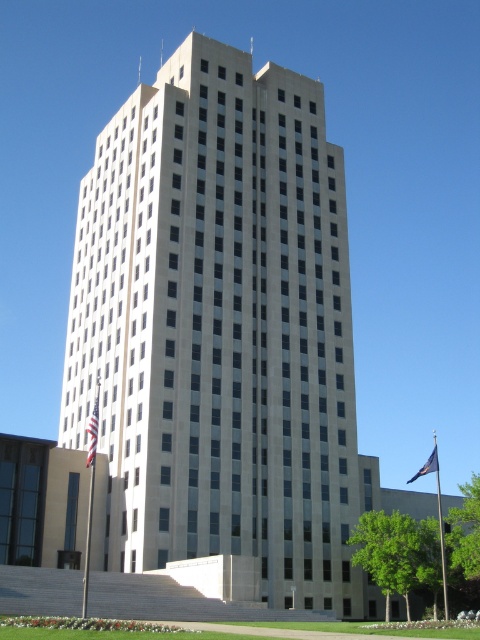
What do you see at coordinates (440, 522) in the screenshot? Image resolution: width=480 pixels, height=640 pixels. I see `metallic flag pole at lower right` at bounding box center [440, 522].

Consider the image. Who is more forward, (444, 589) or (434, 467)?

Point (444, 589) is more forward.

This screenshot has height=640, width=480. Identify the location of metallic flag pole at lower right. (440, 522).

Does beige concrete tower at center appear over american flag at left?

Yes, beige concrete tower at center is above american flag at left.

Which is more to the right, beige concrete tower at center or american flag at left?

beige concrete tower at center

Between point (352, 444) and point (90, 419), which one is positioned behind?

The point (90, 419) is behind.

I want to click on beige concrete tower at center, so click(x=220, y=328).

Who is more forward, (92,460) or (429,460)?

Point (92,460) is in front.

Can you confirm if american flag at left is taller than blue fabric flag at lower right?

Incorrect, american flag at left's height is not larger of blue fabric flag at lower right's.

Who is more distant from viewer, (85, 429) or (416, 477)?

Point (416, 477)

You are a GUI agent. You are given a task and a screenshot of the screen. Output one action in this format:
    pyautogui.click(x=<x>, y=<y>)
    Task: Click on the american flag at left
    Image resolution: width=480 pixels, height=640 pixels.
    Given the screenshot: What is the action you would take?
    pyautogui.click(x=93, y=432)